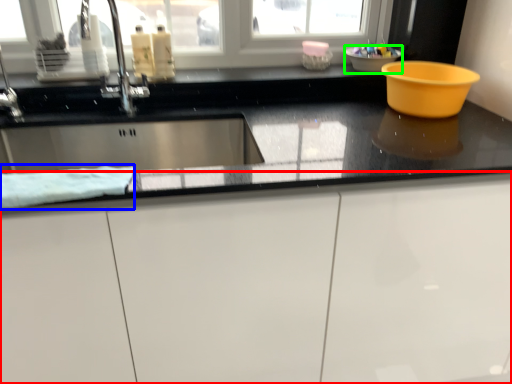
Question: Which object is the farthest from cabinetry (highlighted by a red box)? Choose among these: blanket (highlighted by a blue box) or basin (highlighted by a green box).

Choices:
 (A) blanket
 (B) basin

Answer: (B)